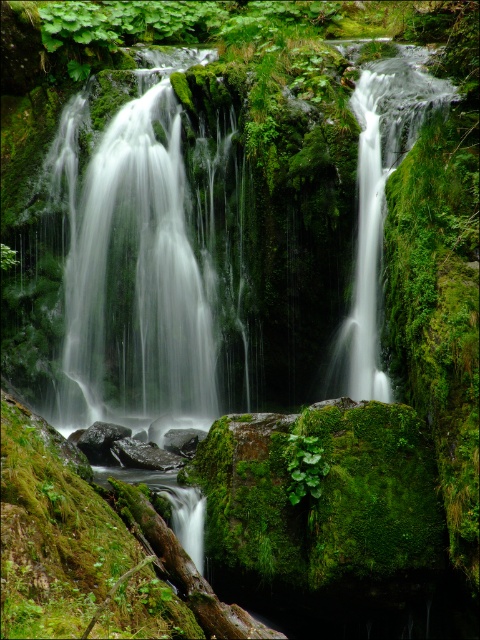
Question: Which point is closer to the camera?

Choices:
 (A) green mossy rock at lower center
 (B) green mossy waterfall at center

Answer: (A)

Question: Considering the relative positions of green mossy waterfall at center and green mossy rock at lower center in the image provided, where is green mossy waterfall at center located with respect to green mossy rock at lower center?

Choices:
 (A) below
 (B) above

Answer: (B)

Question: Which point is farther to the camera?

Choices:
 (A) green mossy rock at lower center
 (B) white smooth waterfall at center

Answer: (B)

Question: Can you confirm if white smooth waterfall at center is bigger than green mossy rock at lower center?

Choices:
 (A) yes
 (B) no

Answer: (A)

Question: Does white smooth waterfall at center have a lesser width compared to green mossy rock at lower center?

Choices:
 (A) yes
 (B) no

Answer: (B)

Question: Which point is farther to the camera?

Choices:
 (A) green mossy waterfall at center
 (B) white smooth waterfall at center

Answer: (A)